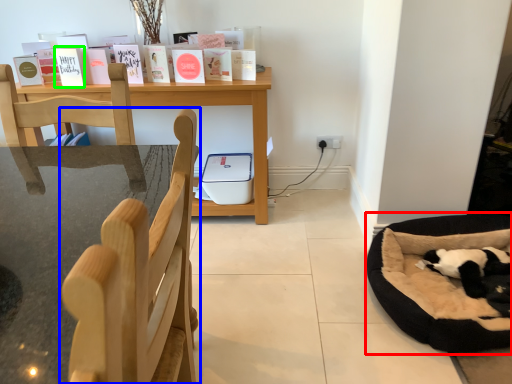
Question: Considering the real-world distances, which object is closest to dog bed (highlighted by a red box)? chair (highlighted by a blue box) or paperback book (highlighted by a green box).

Choices:
 (A) chair
 (B) paperback book

Answer: (A)